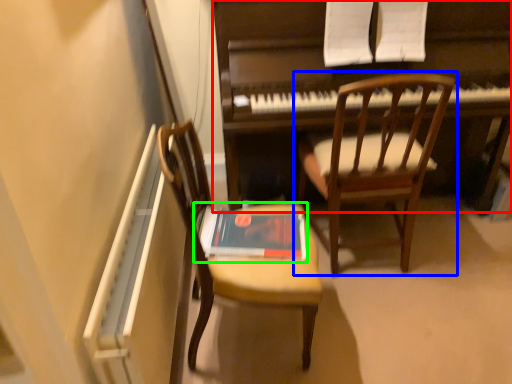
Question: Based on their relative distances, which object is farther from piano (highlighted by a red box)? Choose from chair (highlighted by a blue box) and paperback book (highlighted by a green box).

Choices:
 (A) chair
 (B) paperback book

Answer: (B)